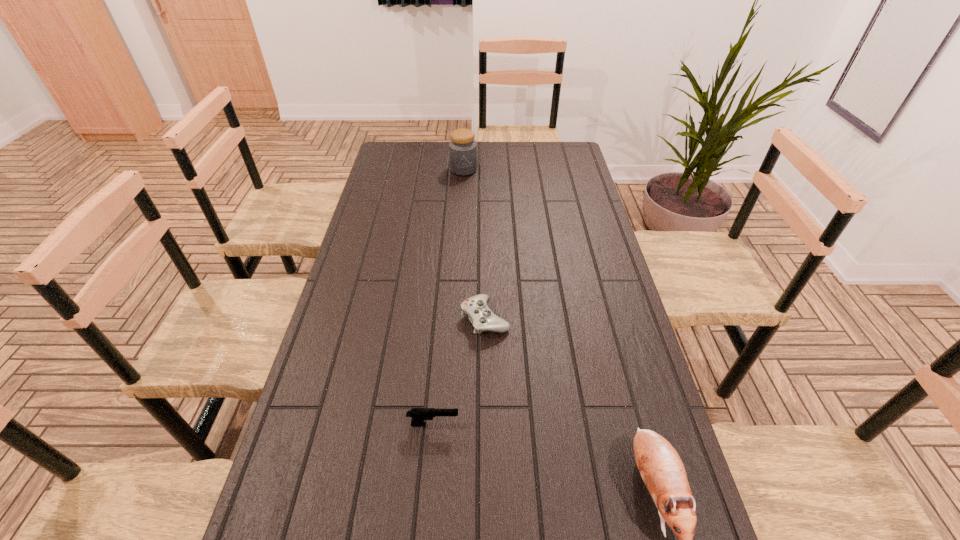
The width and height of the screenshot is (960, 540). Identify the location of free space at the far left corner of the desktop. (392, 162).

The image size is (960, 540). I want to click on free space between the control and the farthest object, so click(474, 244).

At what (x,y) coordinates should I click in order to perform the action: click on vacant area that lies between the farthest object and the control. Please return your answer as a coordinate pair (x, y). Looking at the image, I should click on (474, 244).

This screenshot has width=960, height=540. I want to click on blank region between the second nearest object and the farthest object, so click(x=448, y=297).

Identify the location of free spot between the control and the jar. This screenshot has height=540, width=960. (474, 244).

Find the location of `free point between the second nearest object and the third nearest object`. free point between the second nearest object and the third nearest object is located at coordinates (459, 371).

This screenshot has height=540, width=960. What are the coordinates of `empty space that is in between the control and the third farthest object` in the screenshot? It's located at [459, 371].

Where is `empty space that is in between the pistol and the tallest object`? This screenshot has width=960, height=540. empty space that is in between the pistol and the tallest object is located at coordinates tap(448, 297).

Locate an element on the screen. Image resolution: width=960 pixels, height=540 pixels. object that is the second closest to the control is located at coordinates (661, 468).

Identify which object is the nearest to the second farthest object. Please provide its 2D coordinates. Your answer should be formatted as a tuple, i.e. [(x, y)], where the tuple contains the x and y coordinates of a point satisfying the conditions above.

[(418, 415)]